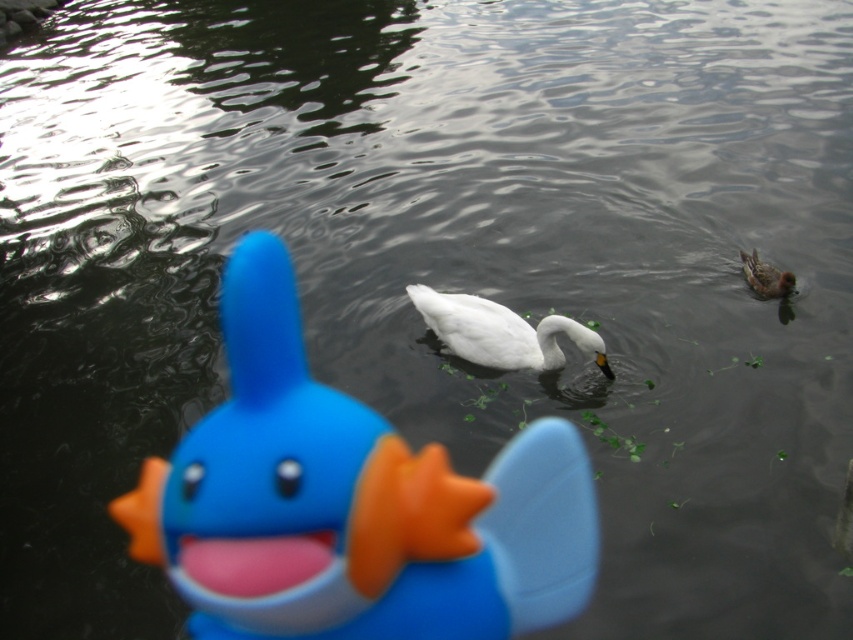
Which is in front, point (421, 534) or point (500, 330)?

Point (421, 534) is in front.

Between rubber duck at center and white matte swan at center, which one has less height?

white matte swan at center is shorter.

Is point (260, 256) behind point (544, 349)?

Yes.

Locate an element on the screen. The height and width of the screenshot is (640, 853). rubber duck at center is located at coordinates (351, 502).

Is the position of rubber duck at center less distant than that of brown speckled feathers at upper right?

Yes, rubber duck at center is closer to the viewer.

Which is behind, point (177, 531) or point (781, 292)?

The point (781, 292) is behind.

Locate an element on the screen. This screenshot has width=853, height=640. rubber duck at center is located at coordinates (351, 502).

Can you confirm if white matte swan at center is wider than brown speckled feathers at upper right?

Yes.

Which of these two, white matte swan at center or brown speckled feathers at upper right, stands shorter?

Standing shorter between the two is brown speckled feathers at upper right.

Who is more forward, (537, 368) or (793, 282)?

Point (537, 368) is more forward.

The image size is (853, 640). I want to click on white matte swan at center, so click(x=502, y=332).